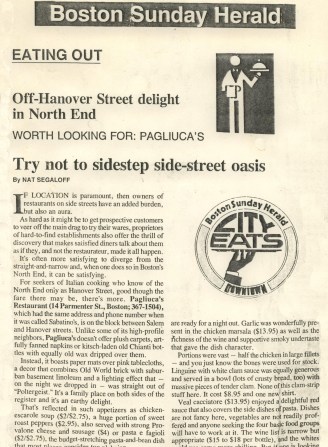
At what (x,y) coordinates should I click in order to perform the action: click on towel. Please return your answer as a coordinate pair (x, y). Image resolution: width=328 pixels, height=447 pixels. Looking at the image, I should click on (230, 90).